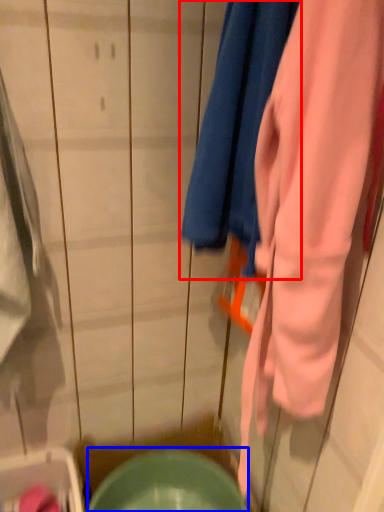
Question: Which of the following is the farthest to the observer, towel (highlighted by a red box) or mixing bowl (highlighted by a blue box)?

Choices:
 (A) towel
 (B) mixing bowl

Answer: (B)